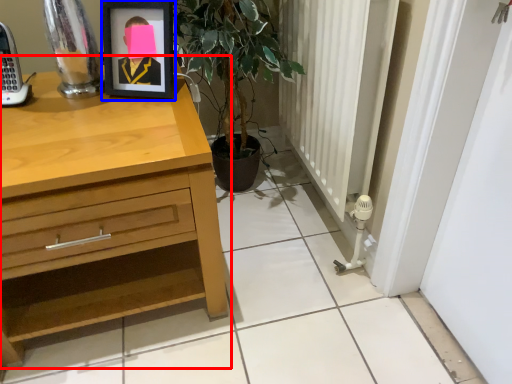
Question: Among these objects, which one is nearest to the camera, chest of drawers (highlighted by a red box) or picture frame (highlighted by a blue box)?

Choices:
 (A) chest of drawers
 (B) picture frame

Answer: (A)